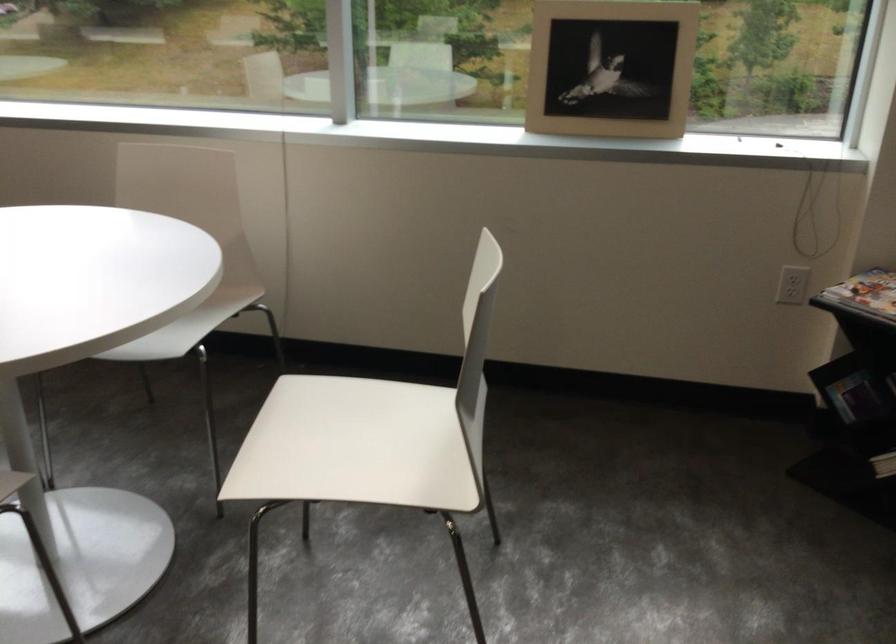
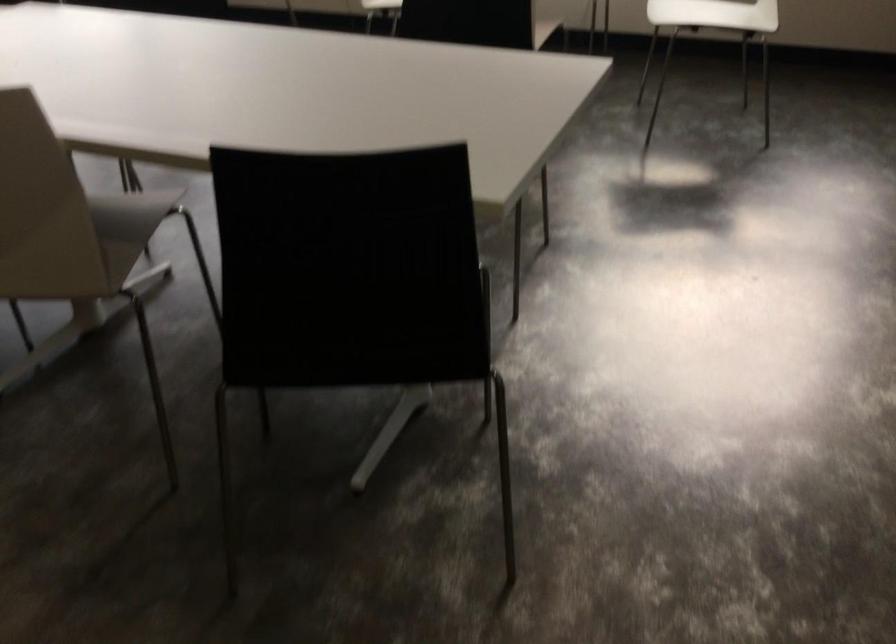
In the second image, find the point that corresponds to (x=388, y=455) in the first image.

(714, 14)